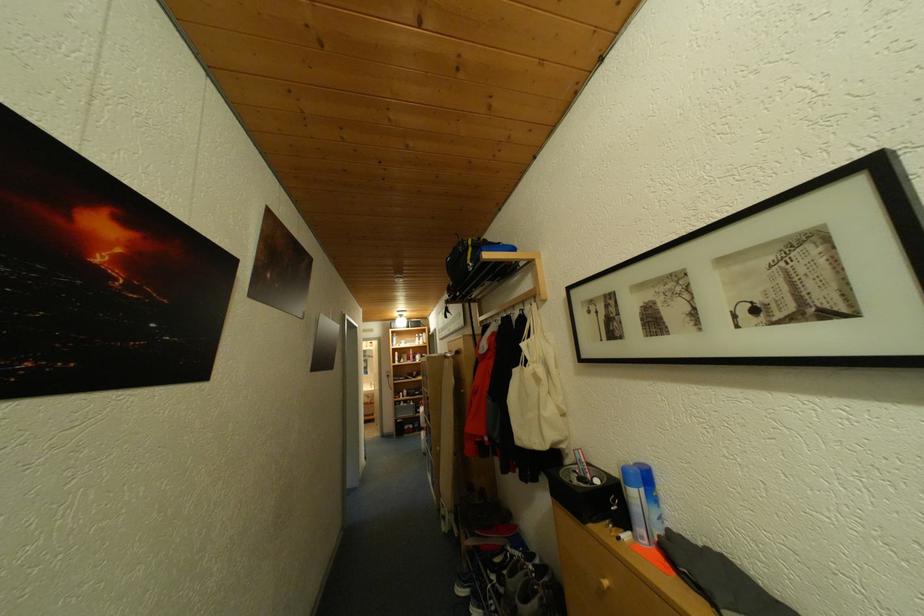
You are a GUI agent. You are given a task and a screenshot of the screen. Output one action in this format:
    pyautogui.click(x=<x>, y=<y>)
    Task: Click on the black tray
    Image resolution: width=924 pixels, height=616 pixels.
    Given the screenshot: What is the action you would take?
    pyautogui.click(x=589, y=495)